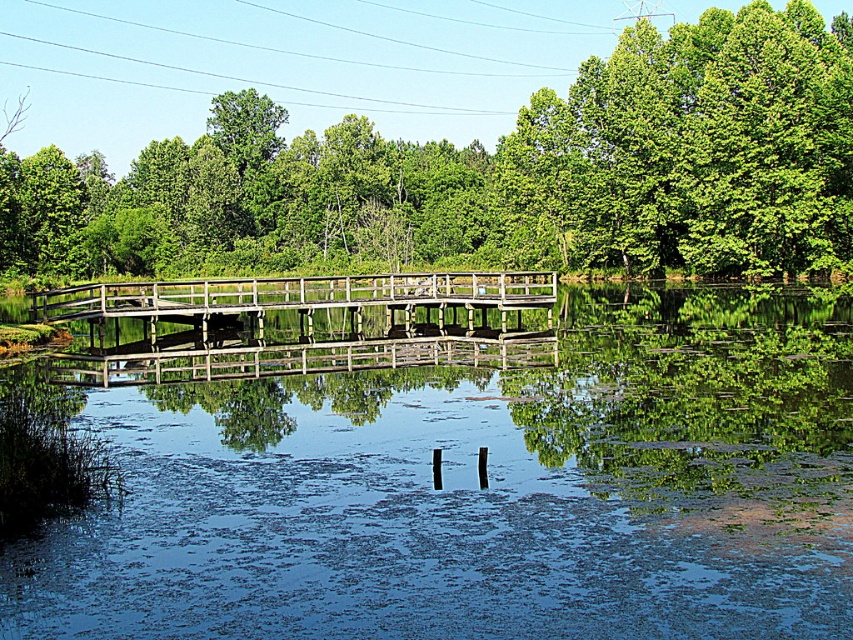
Question: Is clear water at center further to the viewer compared to green leafy tree at center?

Choices:
 (A) no
 (B) yes

Answer: (A)

Question: Which of the following is the farthest from the observer?

Choices:
 (A) (547, 74)
 (B) (457, 276)

Answer: (A)

Question: Observing the image, what is the correct spatial positioning of clear water at center in reference to green leafy tree at center?

Choices:
 (A) right
 (B) left

Answer: (A)

Question: Which object appears farthest from the camera in this image?

Choices:
 (A) clear water at center
 (B) wooden bridge at center

Answer: (B)

Question: Considering the real-world distances, which object is farthest from the green leafy tree at center?

Choices:
 (A) wooden bridge at center
 (B) clear water at center

Answer: (B)

Question: Can you confirm if clear water at center is positioned to the left of wooden bridge at center?

Choices:
 (A) no
 (B) yes

Answer: (A)